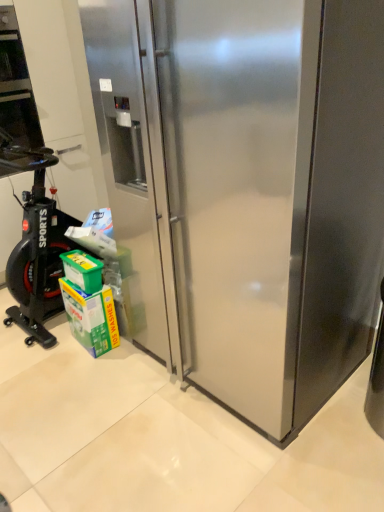
Question: Is green cardboard carton at lower left in front of or behind green plastic box at lower left in the image?

Choices:
 (A) behind
 (B) front

Answer: (A)

Question: Looking at their shapes, would you say green cardboard carton at lower left is wider or thinner than green plastic box at lower left?

Choices:
 (A) wide
 (B) thin

Answer: (B)

Question: Which is farther from the green plastic box at lower left?

Choices:
 (A) stainless steel refrigerator at center
 (B) green cardboard carton at lower left
 (C) black rubber exercise bike at left

Answer: (A)

Question: Estimate the real-world distances between objects in this image. Which object is closer to the stainless steel refrigerator at center?

Choices:
 (A) green cardboard carton at lower left
 (B) black rubber exercise bike at left
 (C) green plastic box at lower left

Answer: (A)